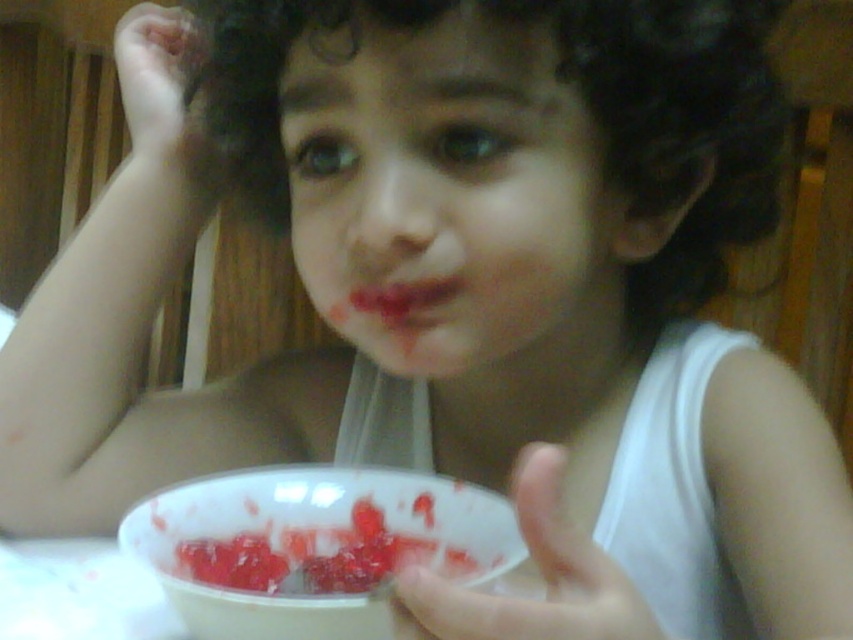
Question: Which point appears farthest from the camera in this image?

Choices:
 (A) click(393, 515)
 (B) click(450, 259)

Answer: (A)

Question: Which of these objects is positioned closest to the white plastic bowl at lower center?

Choices:
 (A) slightly glossy plastic bowl at lower center
 (B) smooth skin face at center

Answer: (A)

Question: In this image, where is smooth skin face at center located relative to slightly glossy plastic bowl at lower center?

Choices:
 (A) below
 (B) above

Answer: (B)

Question: From the image, what is the correct spatial relationship of smooth skin face at center in relation to white plastic bowl at lower center?

Choices:
 (A) left
 (B) right

Answer: (B)

Question: Which of the following is the farthest from the observer?

Choices:
 (A) (412, 477)
 (B) (367, 509)

Answer: (A)

Question: Does white plastic bowl at lower center have a greater width compared to slightly glossy plastic bowl at lower center?

Choices:
 (A) no
 (B) yes

Answer: (B)